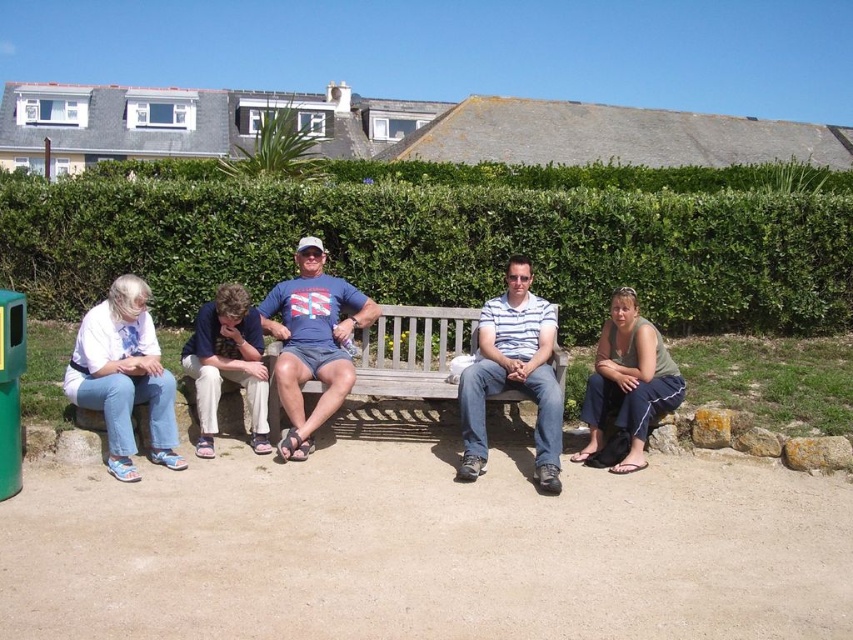
Question: Is striped cotton shirt at center above blue denim shorts at center?

Choices:
 (A) no
 (B) yes

Answer: (B)

Question: Which of these objects is positioned closest to the green leafy hedge at center?

Choices:
 (A) denim pants at left
 (B) green fabric pants at center
 (C) striped cotton shirt at center
 (D) blue denim shorts at center

Answer: (B)

Question: Which is farther from the green leafy hedge at center?

Choices:
 (A) striped cotton shirt at center
 (B) denim pants at left
 (C) blue denim shorts at center
 (D) green fabric pants at center

Answer: (B)

Question: Estimate the real-world distances between objects in this image. Which object is farther from the matte blue jeans at center?

Choices:
 (A) blue cotton t-shirt at center
 (B) green leafy hedge at center
 (C) blue denim shorts at center

Answer: (B)

Question: Is denim pants at left bigger than blue denim shorts at center?

Choices:
 (A) yes
 (B) no

Answer: (A)

Question: Can you confirm if denim pants at left is smaller than green fabric pants at center?

Choices:
 (A) yes
 (B) no

Answer: (A)